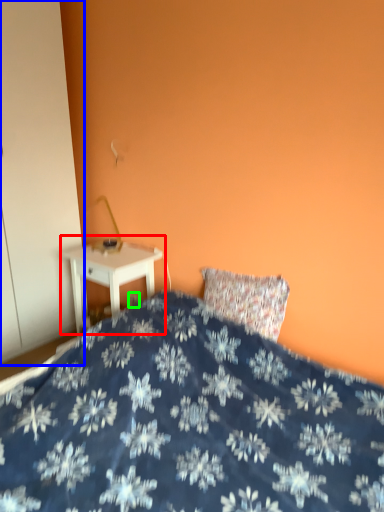
Question: Which is nearer to the nightstand (highlighted by a red box)? armoire (highlighted by a blue box) or electric outlet (highlighted by a green box).

Choices:
 (A) armoire
 (B) electric outlet

Answer: (B)